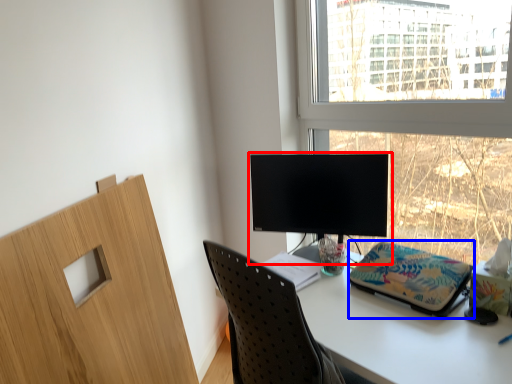
Question: Which object is further to the camera taking this photo, computer monitor (highlighted by a red box) or stationery (highlighted by a blue box)?

Choices:
 (A) computer monitor
 (B) stationery

Answer: (A)